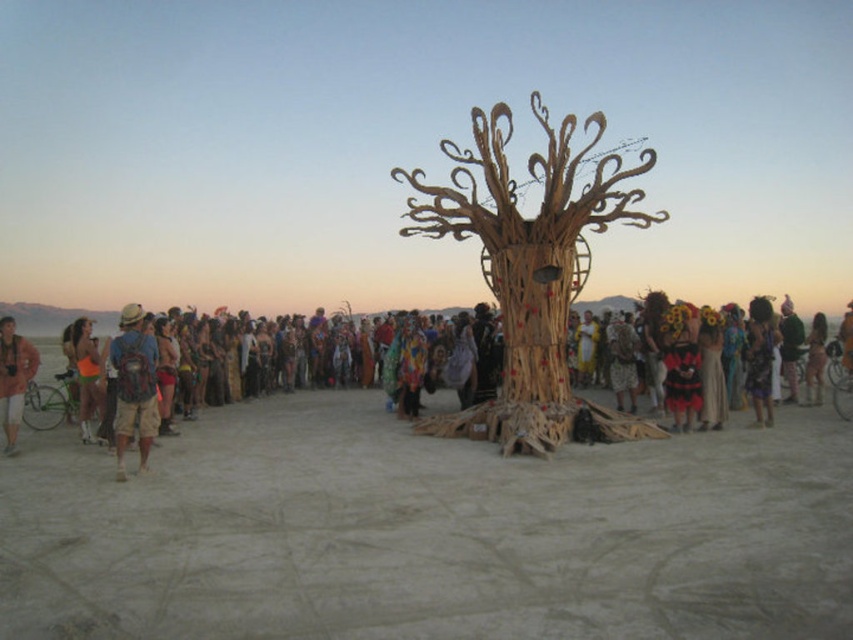
Question: Does matte blue backpack at left appear under matte brown backpack at left?

Choices:
 (A) yes
 (B) no

Answer: (A)

Question: Considering the real-world distances, which object is closest to the multicolored fabric dress at center?

Choices:
 (A) bamboo sculpture at center
 (B) orange fabric bikini at left
 (C) wooden mask at center
 (D) matte brown backpack at left

Answer: (C)

Question: Considering the relative positions of bamboo sculpture at center and matte blue backpack at left in the image provided, where is bamboo sculpture at center located with respect to matte blue backpack at left?

Choices:
 (A) above
 (B) below

Answer: (A)

Question: Which of the following is the closest to the observer?

Choices:
 (A) (152, 397)
 (B) (99, 413)
 (C) (770, 371)
 (D) (3, 371)

Answer: (A)

Question: Does multicolored fabric dress at center have a smaller size compared to orange fabric bikini at left?

Choices:
 (A) yes
 (B) no

Answer: (B)

Question: Based on their relative distances, which object is farther from the matte brown backpack at left?

Choices:
 (A) multicolored fabric dress at center
 (B) orange fabric bikini at left

Answer: (A)